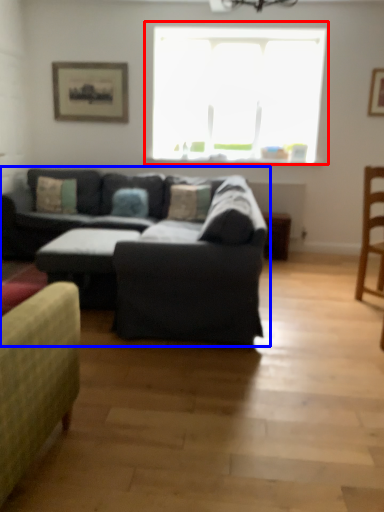
Question: Which point is closer to the camera, window (highlighted by a red box) or studio couch (highlighted by a blue box)?

Choices:
 (A) window
 (B) studio couch

Answer: (B)